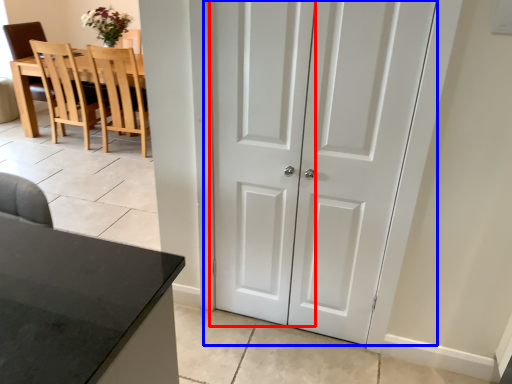
Question: Which point is closer to the camera, screen door (highlighted by a red box) or door (highlighted by a blue box)?

Choices:
 (A) screen door
 (B) door

Answer: (B)